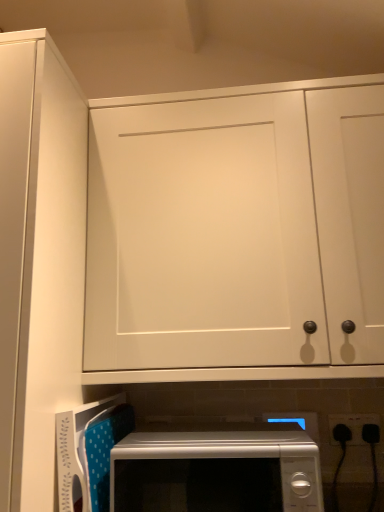
Where is `white glossy microwave at lower center`? white glossy microwave at lower center is located at coordinates (216, 471).

What is the approximate width of white glossy microwave at lower center?

17.09 inches.

Image resolution: width=384 pixels, height=512 pixels. I want to click on black plastic electrical outlet at lower right, so click(x=352, y=425).

Measure the distance between point (353, 435) and camera.

A distance of 4.02 feet exists between point (353, 435) and camera.

Measure the distance between point (278, 200) and camera.

Point (278, 200) and camera are 3.56 feet apart from each other.

This screenshot has height=512, width=384. What do you see at coordinates (202, 236) in the screenshot?
I see `white matte cabinet door at upper center, positioned as the second door in left-to-right order` at bounding box center [202, 236].

What are the coordinates of `white glossy microwave at lower center` in the screenshot? It's located at (216, 471).

Based on the photo, is white matte cabinet door at upper left, arranged as the 2th door when viewed from the right, inside the boundaries of white matte cabinet door at upper center, positioned as the second door in left-to-right order, or outside?

The correct answer is: outside.

Which is in front, point (32, 426) or point (221, 181)?

Point (32, 426)

From a real-world perspective, which is physically above, white matte cabinet door at upper left, the 1th door from the left, or white matte cabinet door at upper center, positioned as the second door in left-to-right order?

white matte cabinet door at upper center, positioned as the second door in left-to-right order, from a real-world perspective.

Considering the sizes of objects white matte cabinet door at upper left, the 1th door from the left, and white matte cabinet door at upper center, positioned as the second door in left-to-right order, in the image provided, who is wider, white matte cabinet door at upper left, the 1th door from the left, or white matte cabinet door at upper center, positioned as the second door in left-to-right order,?

white matte cabinet door at upper left, the 1th door from the left, is wider.

What's the angular difference between white glossy microwave at lower center and white matte cabinet door at upper center, which appears as the first door when viewed from the right,'s facing directions?

0.186 degrees.

Considering the positions of point (300, 459) and point (113, 196), is point (300, 459) closer or farther from the camera than point (113, 196)?

Point (300, 459) appears to be closer to the viewer than point (113, 196).

Which of these two, white glossy microwave at lower center or white matte cabinet door at upper center, which appears as the first door when viewed from the right, is thinner?

Thinner between the two is white matte cabinet door at upper center, which appears as the first door when viewed from the right.

Is white glossy microwave at lower center situated inside white matte cabinet door at upper center, which appears as the first door when viewed from the right, or outside?

white glossy microwave at lower center exists outside the volume of white matte cabinet door at upper center, which appears as the first door when viewed from the right.

Is point (262, 450) closer to camera compared to point (374, 420)?

That is True.

Is white glossy microwave at lower center far from black plastic electrical outlet at lower right?

No, there isn't a large distance between white glossy microwave at lower center and black plastic electrical outlet at lower right.

How different are the orientations of white glossy microwave at lower center and black plastic electrical outlet at lower right in degrees?

1.27 degrees separate the facing orientations of white glossy microwave at lower center and black plastic electrical outlet at lower right.

From a real-world perspective, is white glossy microwave at lower center positioned under black plastic electrical outlet at lower right based on gravity?

Yes, from a real-world perspective, white glossy microwave at lower center is under black plastic electrical outlet at lower right.

Does black plastic electrical outlet at lower right have a greater width compared to white matte cabinet door at upper left, arranged as the 2th door when viewed from the right?

In fact, black plastic electrical outlet at lower right might be narrower than white matte cabinet door at upper left, arranged as the 2th door when viewed from the right.

From a real-world perspective, is black plastic electrical outlet at lower right positioned under white matte cabinet door at upper left, arranged as the 2th door when viewed from the right, based on gravity?

Yes.

Which object is positioned more to the right, black plastic electrical outlet at lower right or white matte cabinet door at upper left, the 1th door from the left?

black plastic electrical outlet at lower right is more to the right.

From a real-world perspective, who is located lower, white matte cabinet door at upper center, positioned as the second door in left-to-right order, or white glossy microwave at lower center?

From a 3D spatial view, white glossy microwave at lower center is below.

Identify the location of door behind the white glossy microwave at lower center. The height and width of the screenshot is (512, 384). (202, 236).

Considering the sizes of objects white matte cabinet door at upper center, which appears as the first door when viewed from the right, and white glossy microwave at lower center in the image provided, who is thinner, white matte cabinet door at upper center, which appears as the first door when viewed from the right, or white glossy microwave at lower center?

With smaller width is white matte cabinet door at upper center, which appears as the first door when viewed from the right.

Is white matte cabinet door at upper center, positioned as the second door in left-to-right order, next to white glossy microwave at lower center and touching it?

No, white matte cabinet door at upper center, positioned as the second door in left-to-right order, is not beside white glossy microwave at lower center.

Is white matte cabinet door at upper left, the 1th door from the left, located outside black plastic electrical outlet at lower right?

Indeed, white matte cabinet door at upper left, the 1th door from the left, is completely outside black plastic electrical outlet at lower right.

Considering the positions of objects white matte cabinet door at upper left, arranged as the 2th door when viewed from the right, and black plastic electrical outlet at lower right in the image provided, who is more to the left, white matte cabinet door at upper left, arranged as the 2th door when viewed from the right, or black plastic electrical outlet at lower right?

From the viewer's perspective, white matte cabinet door at upper left, arranged as the 2th door when viewed from the right, appears more on the left side.

From the image's perspective, is white matte cabinet door at upper left, arranged as the 2th door when viewed from the right, positioned above or below black plastic electrical outlet at lower right?

white matte cabinet door at upper left, arranged as the 2th door when viewed from the right, is above black plastic electrical outlet at lower right.

From the image's perspective, which is below, white matte cabinet door at upper center, positioned as the second door in left-to-right order, or black plastic electrical outlet at lower right?

From the image's view, black plastic electrical outlet at lower right is below.

Is the position of white matte cabinet door at upper center, positioned as the second door in left-to-right order, less distant than that of black plastic electrical outlet at lower right?

That is True.

Between white matte cabinet door at upper center, which appears as the first door when viewed from the right, and black plastic electrical outlet at lower right, which one has larger size?

Bigger between the two is white matte cabinet door at upper center, which appears as the first door when viewed from the right.

Locate an element on the screen. door on the right of white matte cabinet door at upper left, arranged as the 2th door when viewed from the right is located at coordinates (202, 236).

The image size is (384, 512). I want to click on the 2nd door above when counting from the white glossy microwave at lower center (from the image's perspective), so 202,236.

When comparing their distances from white matte cabinet door at upper left, the 1th door from the left, does white glossy microwave at lower center or white plastic microwave at lower center seem further?

The object further to white matte cabinet door at upper left, the 1th door from the left, is white glossy microwave at lower center.

Which object lies nearer to the anchor point white glossy microwave at lower center, white matte cabinet door at upper center, positioned as the second door in left-to-right order, or white matte cabinet door at upper left, the 1th door from the left?

white matte cabinet door at upper center, positioned as the second door in left-to-right order, is positioned closer to the anchor white glossy microwave at lower center.

Considering their positions, is white matte cabinet door at upper center, positioned as the second door in left-to-right order, positioned further to white matte cabinet door at upper left, arranged as the 2th door when viewed from the right, than black plastic electrical outlet at lower right?

black plastic electrical outlet at lower right is positioned further to the anchor white matte cabinet door at upper left, arranged as the 2th door when viewed from the right.

Looking at the image, which one is located further to white matte cabinet door at upper left, arranged as the 2th door when viewed from the right, white matte cabinet door at upper center, positioned as the second door in left-to-right order, or white plastic microwave at lower center?

Based on the image, white plastic microwave at lower center appears to be further to white matte cabinet door at upper left, arranged as the 2th door when viewed from the right.

Looking at the image, which one is located closer to white matte cabinet door at upper left, arranged as the 2th door when viewed from the right, black plastic electrical outlet at lower right or white matte cabinet door at upper center, positioned as the second door in left-to-right order?

The object closer to white matte cabinet door at upper left, arranged as the 2th door when viewed from the right, is white matte cabinet door at upper center, positioned as the second door in left-to-right order.

Based on their spatial positions, is white matte cabinet door at upper center, which appears as the first door when viewed from the right, or white glossy microwave at lower center further from white plastic microwave at lower center?

Based on the image, white matte cabinet door at upper center, which appears as the first door when viewed from the right, appears to be further to white plastic microwave at lower center.

Which object lies nearer to the anchor point white plastic microwave at lower center, white matte cabinet door at upper left, arranged as the 2th door when viewed from the right, or black plastic electrical outlet at lower right?

white matte cabinet door at upper left, arranged as the 2th door when viewed from the right, is closer to white plastic microwave at lower center.

Which object lies nearer to the anchor point white glossy microwave at lower center, white matte cabinet door at upper left, arranged as the 2th door when viewed from the right, or white plastic microwave at lower center?

white plastic microwave at lower center lies closer to white glossy microwave at lower center than the other object.

I want to click on microwave oven between white matte cabinet door at upper left, the 1th door from the left, and white matte cabinet door at upper center, positioned as the second door in left-to-right order, so click(216, 471).

Identify the location of appliance that lies between white matte cabinet door at upper center, positioned as the second door in left-to-right order, and white glossy microwave at lower center from top to bottom. The image size is (384, 512). (89, 452).

I want to click on appliance between white matte cabinet door at upper left, the 1th door from the left, and black plastic electrical outlet at lower right, so click(89, 452).

You are a GUI agent. You are given a task and a screenshot of the screen. Output one action in this format:
    pyautogui.click(x=<x>, y=<y>)
    Task: Click on the appliance situated between white matte cabinet door at upper left, the 1th door from the left, and white glossy microwave at lower center from left to right
    The image size is (384, 512).
    Given the screenshot: What is the action you would take?
    pyautogui.click(x=89, y=452)